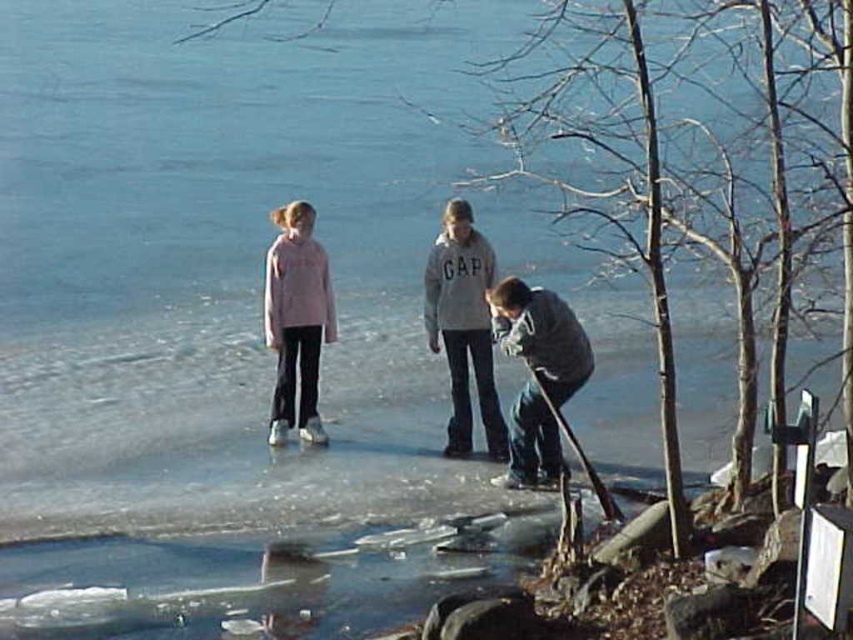
Can you confirm if gray cotton hoodie at center is smaller than gray wool sweater at lower center?

Actually, gray cotton hoodie at center might be larger than gray wool sweater at lower center.

Which is behind, point (461, 268) or point (546, 333)?

The point (461, 268) is more distant.

Describe the element at coordinates (463, 326) in the screenshot. I see `gray cotton hoodie at center` at that location.

The image size is (853, 640). I want to click on gray cotton hoodie at center, so click(463, 326).

Which of these two, gray cotton hoodie at center or pink fleece jacket at center, stands taller?

gray cotton hoodie at center is taller.

Does gray cotton hoodie at center appear on the left side of pink fleece jacket at center?

In fact, gray cotton hoodie at center is to the right of pink fleece jacket at center.

Find the location of a particular element. The height and width of the screenshot is (640, 853). gray cotton hoodie at center is located at coordinates (463, 326).

Is gray wool sweater at lower center further to camera compared to pink fleece jacket at center?

That is False.

Does point (561, 380) come closer to viewer compared to point (297, 285)?

Yes, it is in front of point (297, 285).

Find the location of a particular element. gray wool sweater at lower center is located at coordinates (543, 336).